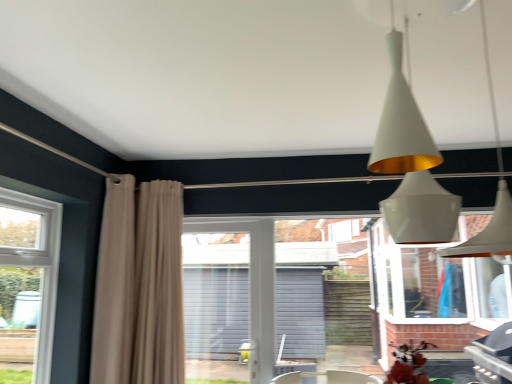
Question: Is beige fabric curtain at left, which ranks as the second curtain in right-to-left order, wider or thinner than white plastic screen door at center?

Choices:
 (A) wide
 (B) thin

Answer: (A)

Question: Would you say beige fabric curtain at left, which ranks as the second curtain in right-to-left order, is to the left or to the right of white plastic screen door at center in the picture?

Choices:
 (A) left
 (B) right

Answer: (A)

Question: Which object is positioned farthest from the white plastic screen door at center?

Choices:
 (A) beige fabric curtain at left, which appears as the first curtain when viewed from the right
 (B) brick wall at center
 (C) white matte cone at upper center
 (D) beige fabric curtain at left, positioned as the first curtain in left-to-right order

Answer: (C)

Question: Based on their relative distances, which object is farther from the white plastic screen door at center?

Choices:
 (A) beige fabric curtain at left, positioned as the first curtain in left-to-right order
 (B) white matte cone at upper center
 (C) beige fabric curtain at left, which appears as the first curtain when viewed from the right
 (D) brick wall at center

Answer: (B)